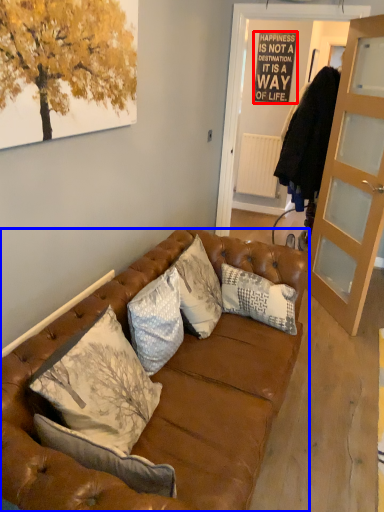
Question: Which of the following is the farthest to the observer, bulletin board (highlighted by a red box) or studio couch (highlighted by a blue box)?

Choices:
 (A) bulletin board
 (B) studio couch

Answer: (A)